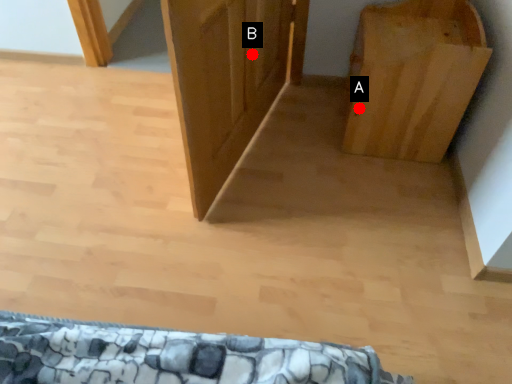
Question: Two points are circled on the image, labeled by A and B beside each circle. Which of the following is the closest to the observer?

Choices:
 (A) A is closer
 (B) B is closer

Answer: (B)